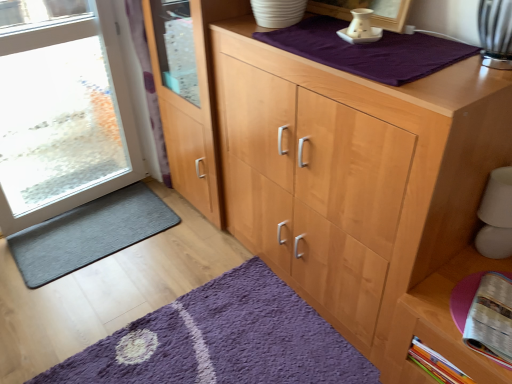
Question: Does clear glass door at left have a smaller size compared to light wood cupboard at center?

Choices:
 (A) yes
 (B) no

Answer: (A)

Question: Is clear glass door at left oriented away from light wood cupboard at center?

Choices:
 (A) yes
 (B) no

Answer: (B)

Question: From the image's perspective, is clear glass door at left on light wood cupboard at center?

Choices:
 (A) yes
 (B) no

Answer: (A)

Question: Considering the relative sizes of clear glass door at left and light wood cupboard at center in the image provided, is clear glass door at left shorter than light wood cupboard at center?

Choices:
 (A) yes
 (B) no

Answer: (B)

Question: Could you tell me if clear glass door at left is turned towards light wood cupboard at center?

Choices:
 (A) no
 (B) yes

Answer: (B)

Question: Does clear glass door at left appear on the right side of light wood cupboard at center?

Choices:
 (A) no
 (B) yes

Answer: (A)

Question: Could you tell me if clear glass door at left is turned towards purple cotton blanket at upper center?

Choices:
 (A) no
 (B) yes

Answer: (B)

Question: Does clear glass door at left appear on the right side of purple cotton blanket at upper center?

Choices:
 (A) no
 (B) yes

Answer: (A)

Question: Would you say clear glass door at left is outside purple cotton blanket at upper center?

Choices:
 (A) yes
 (B) no

Answer: (A)

Question: Is clear glass door at left next to purple cotton blanket at upper center?

Choices:
 (A) yes
 (B) no

Answer: (B)

Question: Does clear glass door at left appear on the left side of purple cotton blanket at upper center?

Choices:
 (A) yes
 (B) no

Answer: (A)

Question: From a real-world perspective, is clear glass door at left positioned under purple cotton blanket at upper center based on gravity?

Choices:
 (A) yes
 (B) no

Answer: (A)

Question: Does light wood cupboard at center have a lesser height compared to purple cotton blanket at upper center?

Choices:
 (A) yes
 (B) no

Answer: (B)